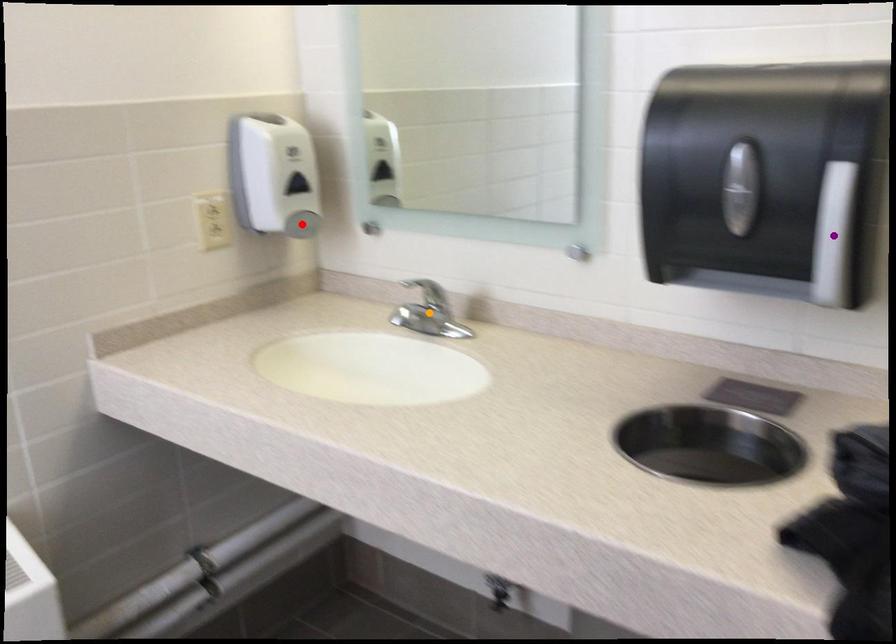
Order these from nearest to farthest:
1. orange point
2. purple point
3. red point

1. purple point
2. red point
3. orange point